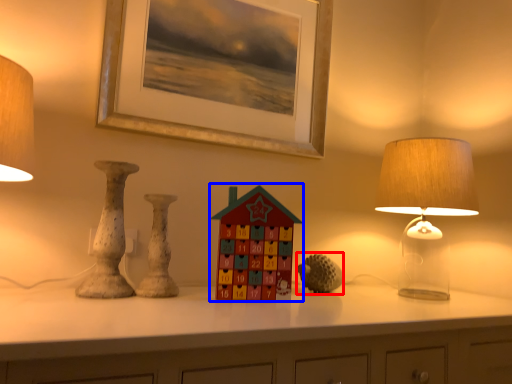
Question: Which point is closer to the camera, toy (highlighted by a red box) or toy (highlighted by a blue box)?

Choices:
 (A) toy
 (B) toy

Answer: (B)